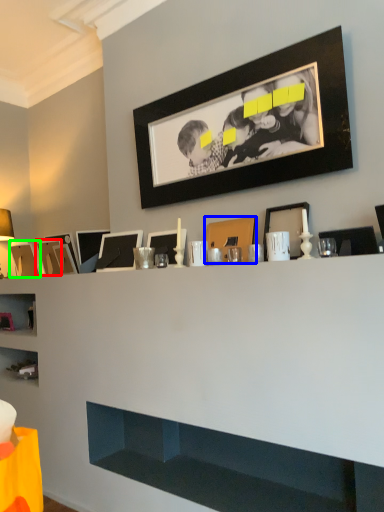
Question: Considering the real-world distances, which object is farthest from picture frame (highlighted by a red box)? picture frame (highlighted by a blue box) or picture frame (highlighted by a green box)?

Choices:
 (A) picture frame
 (B) picture frame

Answer: (A)